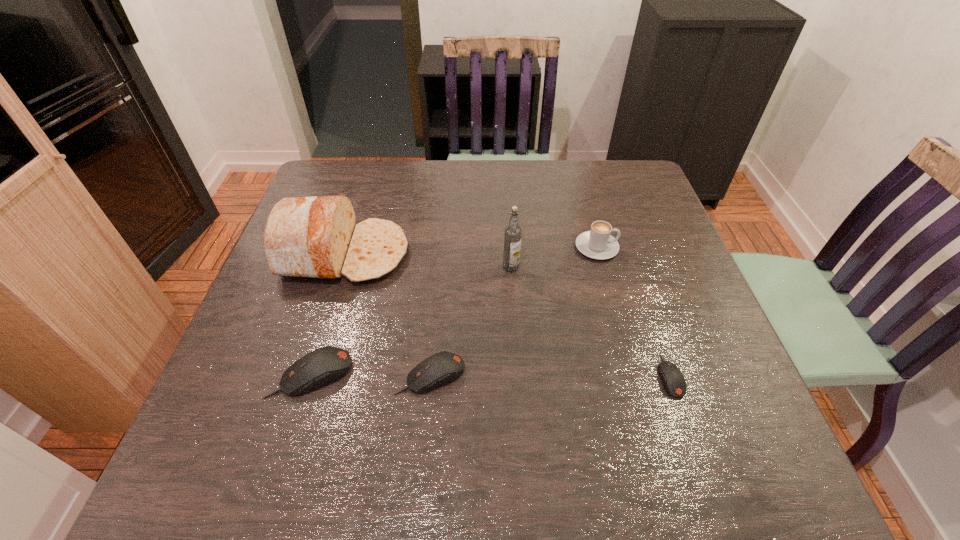
You are a GUI agent. You are given a task and a screenshot of the screen. Output one action in this format:
    pyautogui.click(x=<x>, y=<y>)
    Task: Click on the leftmost computer mouse
    The height and width of the screenshot is (540, 960).
    Given the screenshot: What is the action you would take?
    pyautogui.click(x=325, y=365)

What are the coordinates of `the fifth tallest object` in the screenshot? It's located at (444, 367).

Identify the location of the third object from left to right. This screenshot has width=960, height=540. (444, 367).

Locate an element on the screen. the shortest object is located at coordinates (673, 382).

Where is `the rightmost computer mouse`? the rightmost computer mouse is located at coordinates click(x=673, y=382).

The image size is (960, 540). In order to click on cappuccino in this screenshot , I will do `click(598, 243)`.

This screenshot has width=960, height=540. What are the coordinates of `vodka` in the screenshot? It's located at (512, 235).

The height and width of the screenshot is (540, 960). Identify the location of the fourth object from left to right. (512, 235).

The height and width of the screenshot is (540, 960). Find the location of `bread`. bread is located at coordinates (316, 237).

Find the location of a particular element. free space located 0.270m on the back of the leftmost computer mouse is located at coordinates (346, 262).